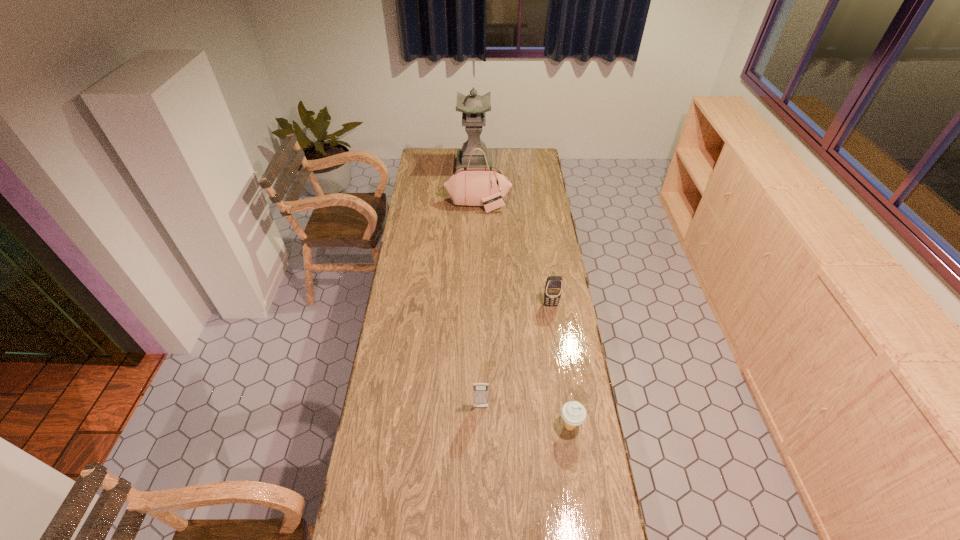
The height and width of the screenshot is (540, 960). In order to click on the farthest object in this screenshot , I will do `click(473, 107)`.

You are a GUI agent. You are given a task and a screenshot of the screen. Output one action in this format:
    pyautogui.click(x=<x>, y=<y>)
    Task: Click on the sculpture
    The image size is (960, 540).
    Given the screenshot: What is the action you would take?
    pyautogui.click(x=473, y=107)

Locate an element on the screen. The width and height of the screenshot is (960, 540). the second tallest object is located at coordinates (473, 186).

Where is `handbag`? handbag is located at coordinates (473, 186).

Locate an element on the screen. The height and width of the screenshot is (540, 960). the nearer cellular telephone is located at coordinates (480, 390).

You are a GUI agent. You are given a task and a screenshot of the screen. Output one action in this format:
    pyautogui.click(x=<x>, y=<y>)
    Task: Click on the left cellular telephone
    
    Given the screenshot: What is the action you would take?
    pyautogui.click(x=480, y=390)

Where is `the farther cellular telephone`? the farther cellular telephone is located at coordinates (553, 288).

Identify the location of the third farthest object. (553, 288).

The height and width of the screenshot is (540, 960). I want to click on icecream, so click(x=573, y=413).

The width and height of the screenshot is (960, 540). I want to click on vacant area situated 0.160m at the front opening of the sculpture, so click(474, 193).